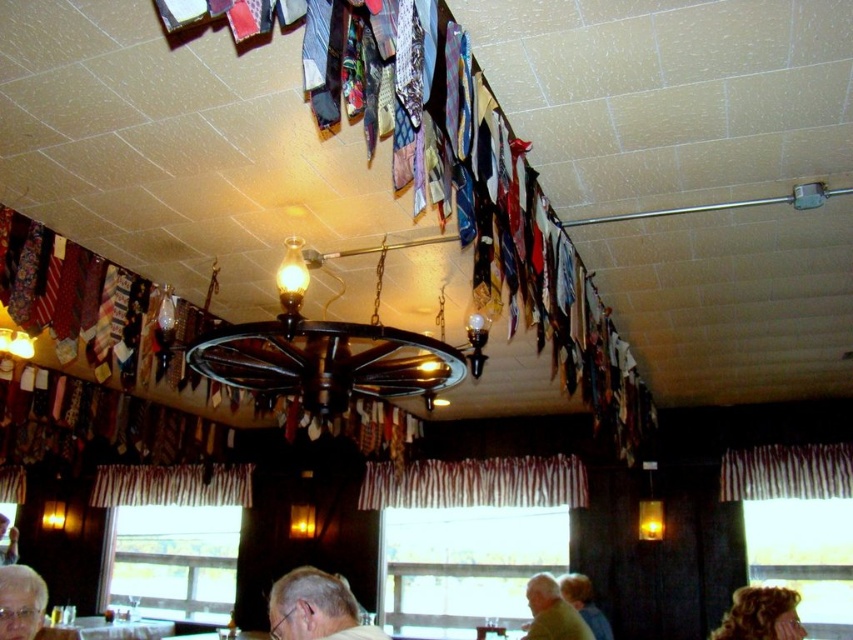
You are a customer sitting at a table in the restaurant and looking up at the ceiling. You notice two points marked on the ceiling. Which of the two points, point (724,467) or point (537,589), is closer to your eyes?

Point (724,467) is closer to your eyes because it is further to the viewer than point (537,589).

You are a customer sitting at the table and want to hang a new fabric item on the wall. You have a striped fabric curtain at lower right and a green fabric shirt at lower right. Which item would require more horizontal space to hang properly?

The striped fabric curtain at lower right requires more horizontal space because its width surpasses that of the green fabric shirt at lower right.

You are a customer at the restaurant and want to see the entrance from your current position. You notice the striped fabric curtain at lower right and the white glossy table at lower center. Which object is closer to the entrance?

The striped fabric curtain at lower right is smaller than the white glossy table at lower center, so it might be closer to the entrance.